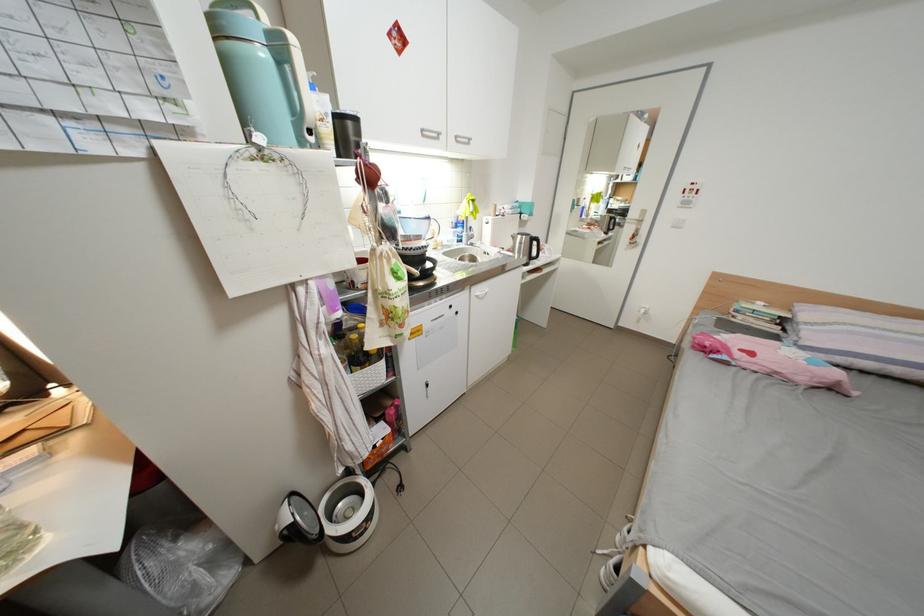
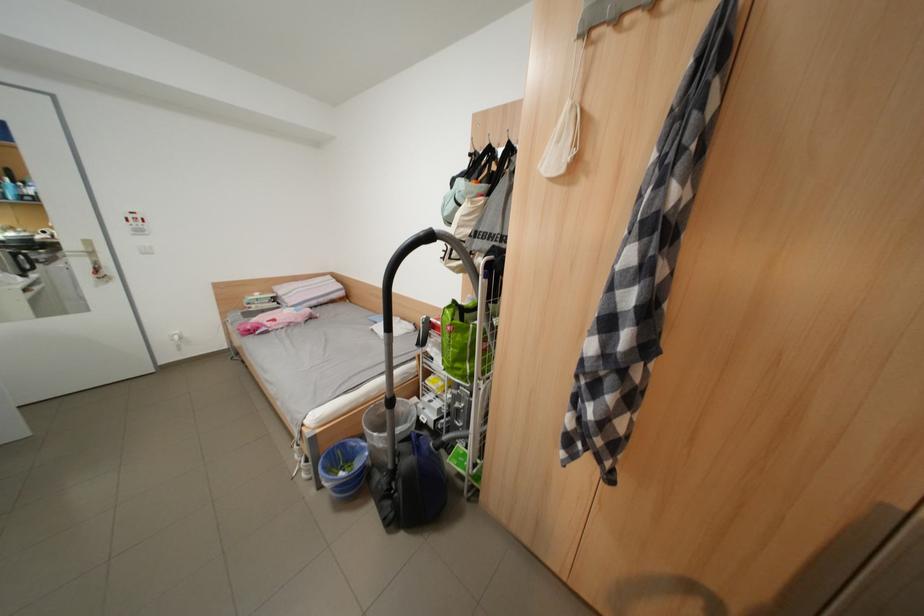
The first image is from the beginning of the video and the second image is from the end. How did the camera likely rotate when shooting the video?

The camera rotated toward right-down.